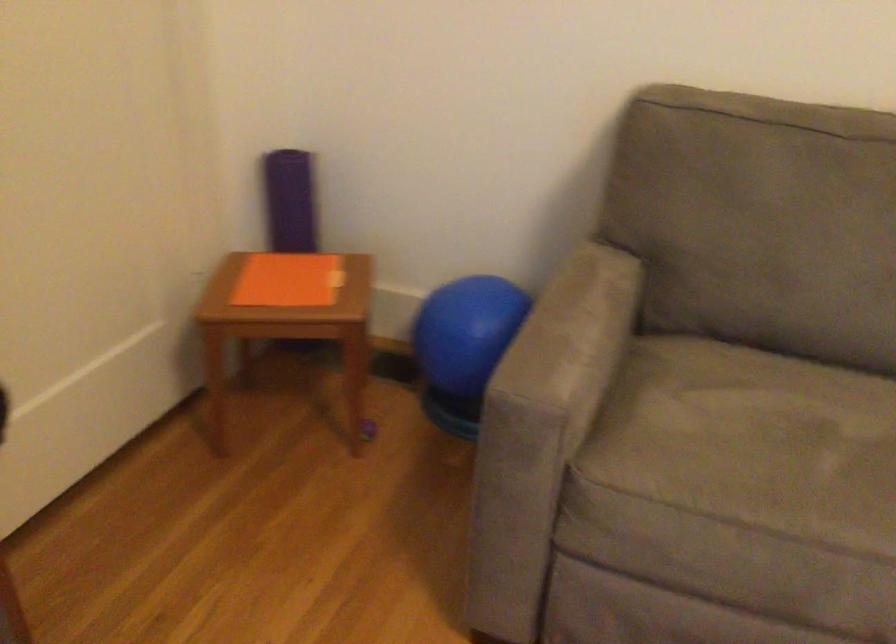
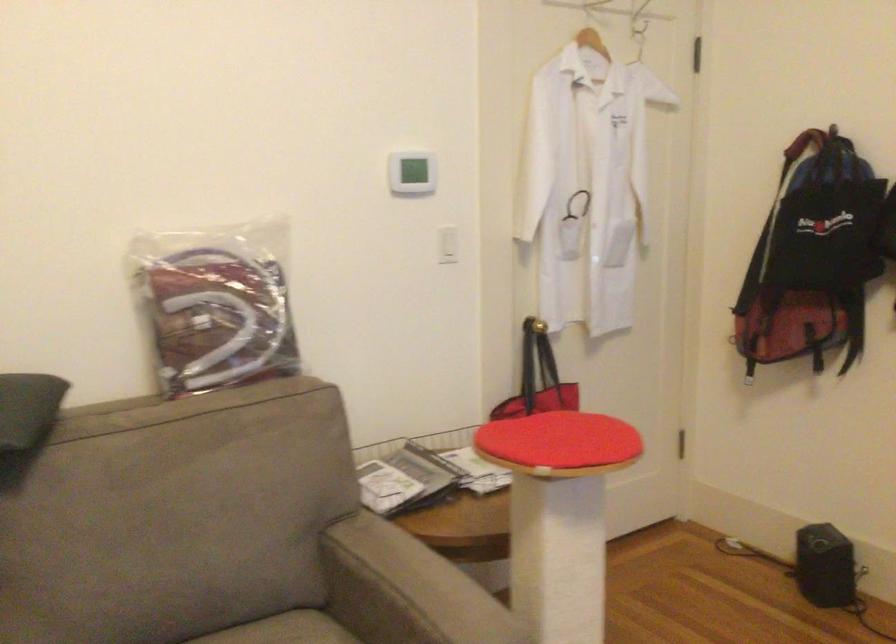
Question: The camera is either moving clockwise (left) or counter-clockwise (right) around the object. The first image is from the beginning of the video and the second image is from the end. Is the camera moving left or right when shooting the video?

Choices:
 (A) Left
 (B) Right

Answer: (A)